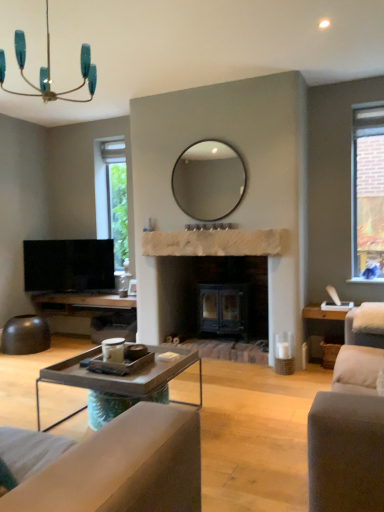
Question: Is matte glass mirror at center facing towards white fabric swivel chair at right?

Choices:
 (A) no
 (B) yes

Answer: (A)

Question: Does matte glass mirror at center have a lesser width compared to white fabric swivel chair at right?

Choices:
 (A) yes
 (B) no

Answer: (A)

Question: Is matte glass mirror at center wider than white fabric swivel chair at right?

Choices:
 (A) no
 (B) yes

Answer: (A)

Question: From a real-world perspective, is matte glass mirror at center positioned under white fabric swivel chair at right based on gravity?

Choices:
 (A) yes
 (B) no

Answer: (B)

Question: From the image's perspective, is matte glass mirror at center below white fabric swivel chair at right?

Choices:
 (A) yes
 (B) no

Answer: (B)

Question: Considering the relative positions of teal glass chandelier at upper left and natural stone fireplace at center in the image provided, is teal glass chandelier at upper left to the left or to the right of natural stone fireplace at center?

Choices:
 (A) left
 (B) right

Answer: (A)

Question: Looking at their shapes, would you say teal glass chandelier at upper left is wider or thinner than natural stone fireplace at center?

Choices:
 (A) wide
 (B) thin

Answer: (A)

Question: From a real-world perspective, is teal glass chandelier at upper left above or below natural stone fireplace at center?

Choices:
 (A) above
 (B) below

Answer: (A)

Question: Considering their positions, is teal glass chandelier at upper left located in front of or behind natural stone fireplace at center?

Choices:
 (A) behind
 (B) front

Answer: (B)

Question: Considering the positions of white fabric swivel chair at right and teal glass chandelier at upper left in the image, is white fabric swivel chair at right bigger or smaller than teal glass chandelier at upper left?

Choices:
 (A) big
 (B) small

Answer: (B)

Question: Is white fabric swivel chair at right to the left or to the right of teal glass chandelier at upper left in the image?

Choices:
 (A) right
 (B) left

Answer: (A)

Question: From a real-world perspective, is white fabric swivel chair at right physically located above or below teal glass chandelier at upper left?

Choices:
 (A) above
 (B) below

Answer: (B)

Question: From the image's perspective, is white fabric swivel chair at right located above or below teal glass chandelier at upper left?

Choices:
 (A) below
 (B) above

Answer: (A)

Question: In terms of width, does flat screen tv at left look wider or thinner when compared to teal glass chandelier at upper left?

Choices:
 (A) thin
 (B) wide

Answer: (A)

Question: From a real-world perspective, is flat screen tv at left above or below teal glass chandelier at upper left?

Choices:
 (A) above
 (B) below

Answer: (B)